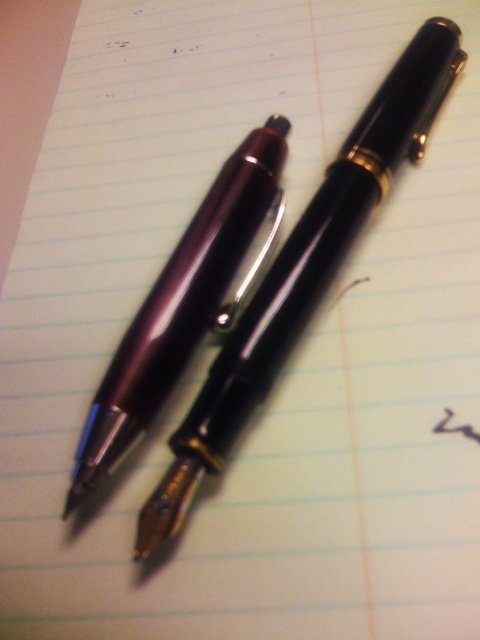
Can you confirm if matte black pen at upper center is bigger than matte purple pen at center?

Correct, matte black pen at upper center is larger in size than matte purple pen at center.

Locate an element on the screen. Image resolution: width=480 pixels, height=640 pixels. matte black pen at upper center is located at coordinates (303, 269).

The height and width of the screenshot is (640, 480). Identify the location of matte black pen at upper center. (303, 269).

You are a GUI agent. You are given a task and a screenshot of the screen. Output one action in this format:
    pyautogui.click(x=<x>, y=<y>)
    Task: Click on the matte black pen at upper center
    The width and height of the screenshot is (480, 640).
    Given the screenshot: What is the action you would take?
    pyautogui.click(x=303, y=269)